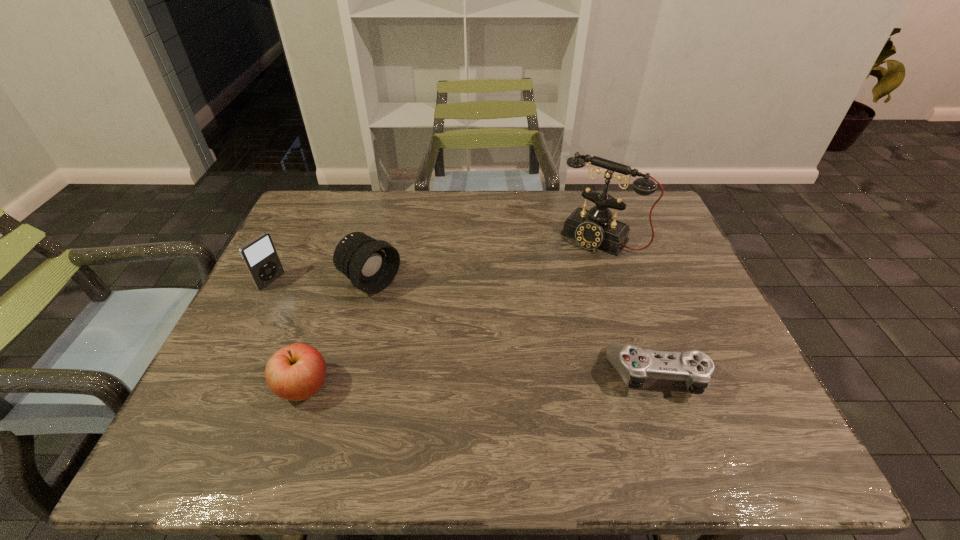
At what (x,y) coordinates should I click in order to perform the action: click on vacant space located on the front-facing side of the iPod. Please return your answer as a coordinate pair (x, y). Looking at the image, I should click on (312, 305).

Locate an element on the screen. vacant region located on the dial of the telephone is located at coordinates (547, 294).

Where is `free location located on the dial of the telephone`? Image resolution: width=960 pixels, height=540 pixels. free location located on the dial of the telephone is located at coordinates (506, 343).

Where is `vacant space located on the dial of the telephone`? The width and height of the screenshot is (960, 540). vacant space located on the dial of the telephone is located at coordinates (538, 305).

Locate an element on the screen. The height and width of the screenshot is (540, 960). vacant space located 0.110m at the front element of the telephoto lens is located at coordinates (422, 316).

At what (x,y) coordinates should I click in order to perform the action: click on free space located 0.320m at the front element of the telephoto lens. Please return your answer as a coordinate pair (x, y). The width and height of the screenshot is (960, 540). Looking at the image, I should click on (488, 360).

In order to click on vacant space situated at the front element of the telephoto lens in this screenshot , I will do `click(434, 324)`.

This screenshot has width=960, height=540. I want to click on object positioned at the far edge, so click(x=593, y=229).

Locate an element on the screen. apple that is at the near edge is located at coordinates (x=296, y=372).

Find the location of a particular element. The height and width of the screenshot is (540, 960). control situated at the near edge is located at coordinates (634, 364).